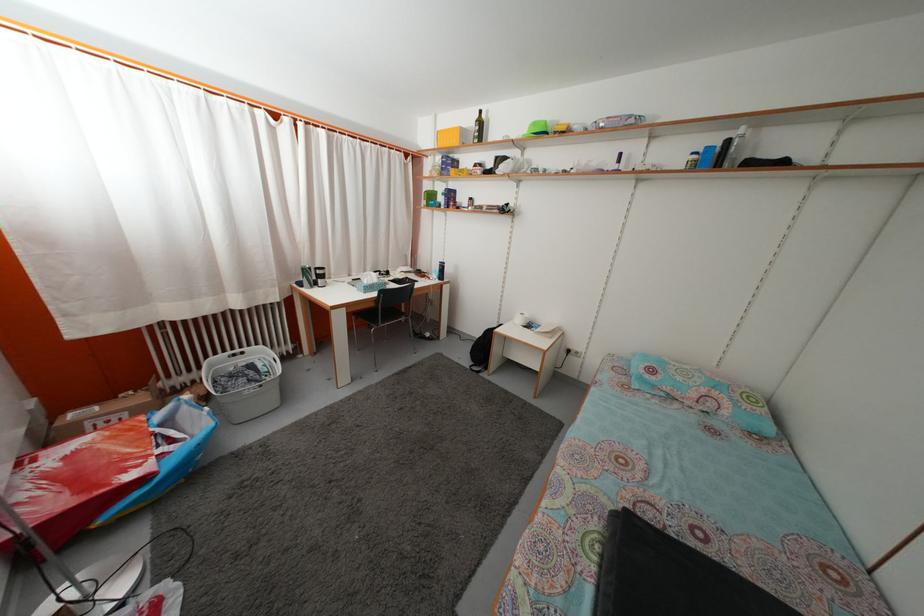
In order to click on yellow cardboard box in this screenshot , I will do `click(453, 137)`.